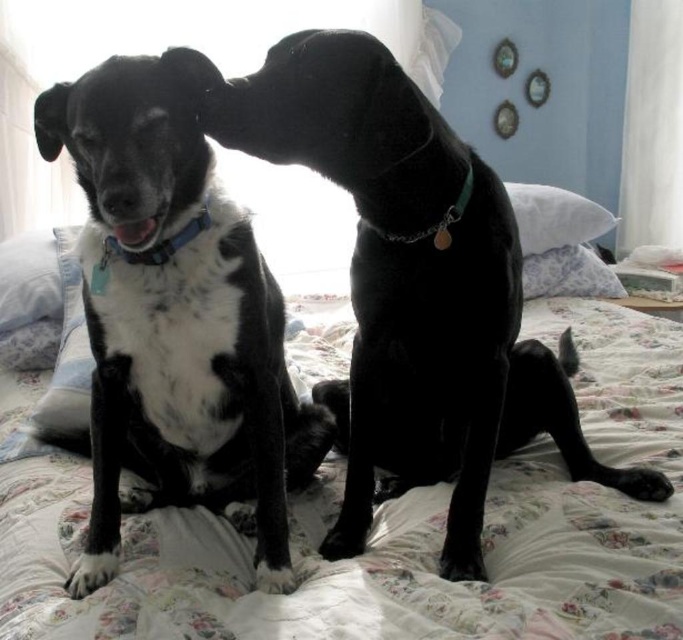
You are a veterinarian examining two dogs in a photo. The dogs are the black shiny dog at center and the white soft paw at lower left. Based on their sizes, which dog would require a larger dog bed?

The black shiny dog at center requires a larger dog bed because it has a larger size compared to the white soft paw at lower left.

You are standing in the bedroom and want to place a small gift exactly where the black shiny dog at center is sitting. What are the coordinates of the location where you should place the gift?

The coordinates of the black shiny dog at center are at point (393, 250), so you should place the gift there.

You are a photographer trying to capture a closeup of the black shiny dog at center and the white soft paw at lower left. Which one would appear larger in your photo?

The black shiny dog at center would appear larger in the photo because it is closer to the viewer than the white soft paw at lower left.